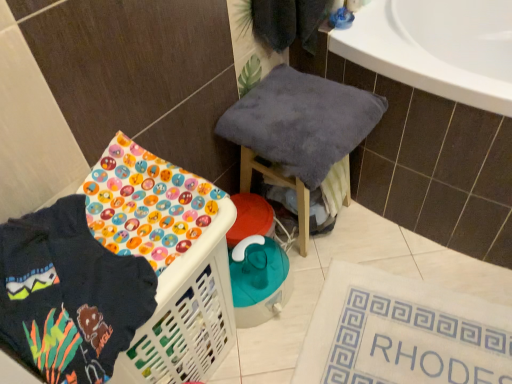
Locate an element on the screen. Image resolution: width=512 pixels, height=384 pixels. white fabric bath mat at lower right is located at coordinates (402, 333).

The image size is (512, 384). Identify the location of soft gray towel at center. (301, 122).

Describe the element at coordinates (69, 295) in the screenshot. This screenshot has height=384, width=512. I see `dark blue fleece sweatshirt at lower left` at that location.

This screenshot has width=512, height=384. In order to click on white fabric bath mat at lower right in this screenshot , I will do `click(402, 333)`.

Is soft gray towel at center at the back of dark blue fleece sweatshirt at lower left?

No.

From a real-world perspective, is dark blue fleece sweatshirt at lower left over soft gray towel at center?

Yes, from a real-world perspective, dark blue fleece sweatshirt at lower left is over soft gray towel at center

Between dark blue fleece sweatshirt at lower left and soft gray towel at center, which one has larger size?

With larger size is soft gray towel at center.

Between soft gray towel at center and dark blue fleece sweatshirt at lower left, which one appears on the right side from the viewer's perspective?

Positioned to the right is soft gray towel at center.

Is soft gray towel at center facing towards dark blue fleece sweatshirt at lower left?

No, soft gray towel at center is not aimed at dark blue fleece sweatshirt at lower left.

Is point (341, 134) positioned behind point (35, 272)?

Yes, point (341, 134) is farther from viewer.

From a real-world perspective, who is located higher, dark blue fleece sweatshirt at lower left or white fabric bath mat at lower right?

dark blue fleece sweatshirt at lower left is physically above.

Between dark blue fleece sweatshirt at lower left and white fabric bath mat at lower right, which one has smaller size?

white fabric bath mat at lower right.

Is dark blue fleece sweatshirt at lower left touching white fabric bath mat at lower right?

They are not placed beside each other.

From a real-world perspective, which object stands above the other?

dark blue fleece sweatshirt at lower left, from a real-world perspective.

I want to click on bath mat that appears below the dark blue fleece sweatshirt at lower left (from the image's perspective), so click(x=402, y=333).

Is white fabric bath mat at lower right far away from dark blue fleece sweatshirt at lower left?

No, white fabric bath mat at lower right is not far from dark blue fleece sweatshirt at lower left.

Considering the sizes of objects white fabric bath mat at lower right and dark blue fleece sweatshirt at lower left in the image provided, who is thinner, white fabric bath mat at lower right or dark blue fleece sweatshirt at lower left?

dark blue fleece sweatshirt at lower left.

Who is taller, soft gray towel at center or white fabric bath mat at lower right?

Standing taller between the two is soft gray towel at center.

Who is smaller, soft gray towel at center or white fabric bath mat at lower right?

white fabric bath mat at lower right.

From a real-world perspective, which is physically above, soft gray towel at center or white fabric bath mat at lower right?

In real-world perspective, soft gray towel at center is above.

Is soft gray towel at center far away from white fabric bath mat at lower right?

No, soft gray towel at center is not far away from white fabric bath mat at lower right.

Who is bigger, white fabric bath mat at lower right or soft gray towel at center?

Bigger between the two is soft gray towel at center.

How many degrees apart are the facing directions of white fabric bath mat at lower right and soft gray towel at center?

white fabric bath mat at lower right and soft gray towel at center are facing 69 degrees away from each other.

Which object is closer to the camera, white fabric bath mat at lower right or soft gray towel at center?

soft gray towel at center is in front.

Is white fabric bath mat at lower right directly adjacent to soft gray towel at center?

No, white fabric bath mat at lower right is not with soft gray towel at center.

Image resolution: width=512 pixels, height=384 pixels. In order to click on clothing below the soft gray towel at center (from the image's perspective) in this screenshot , I will do `click(69, 295)`.

I want to click on clothing in front of the soft gray towel at center, so click(69, 295).

Which object lies further to the anchor point soft gray towel at center, dark blue fleece sweatshirt at lower left or white fabric bath mat at lower right?

dark blue fleece sweatshirt at lower left is further to soft gray towel at center.

Estimate the real-world distances between objects in this image. Which object is closer to dark blue fleece sweatshirt at lower left, soft gray towel at center or white fabric bath mat at lower right?

Based on the image, soft gray towel at center appears to be nearer to dark blue fleece sweatshirt at lower left.

When comparing their distances from white fabric bath mat at lower right, does dark blue fleece sweatshirt at lower left or soft gray towel at center seem further?

Based on the image, dark blue fleece sweatshirt at lower left appears to be further to white fabric bath mat at lower right.

When comparing their distances from soft gray towel at center, does white fabric bath mat at lower right or dark blue fleece sweatshirt at lower left seem closer?

white fabric bath mat at lower right is closer to soft gray towel at center.

From the image, which object appears to be farther from white fabric bath mat at lower right, soft gray towel at center or dark blue fleece sweatshirt at lower left?

dark blue fleece sweatshirt at lower left lies further to white fabric bath mat at lower right than the other object.

Which object lies further to the anchor point dark blue fleece sweatshirt at lower left, white fabric bath mat at lower right or soft gray towel at center?

white fabric bath mat at lower right is positioned further to the anchor dark blue fleece sweatshirt at lower left.

The image size is (512, 384). I want to click on baby clothe between dark blue fleece sweatshirt at lower left and white fabric bath mat at lower right from left to right, so click(x=301, y=122).